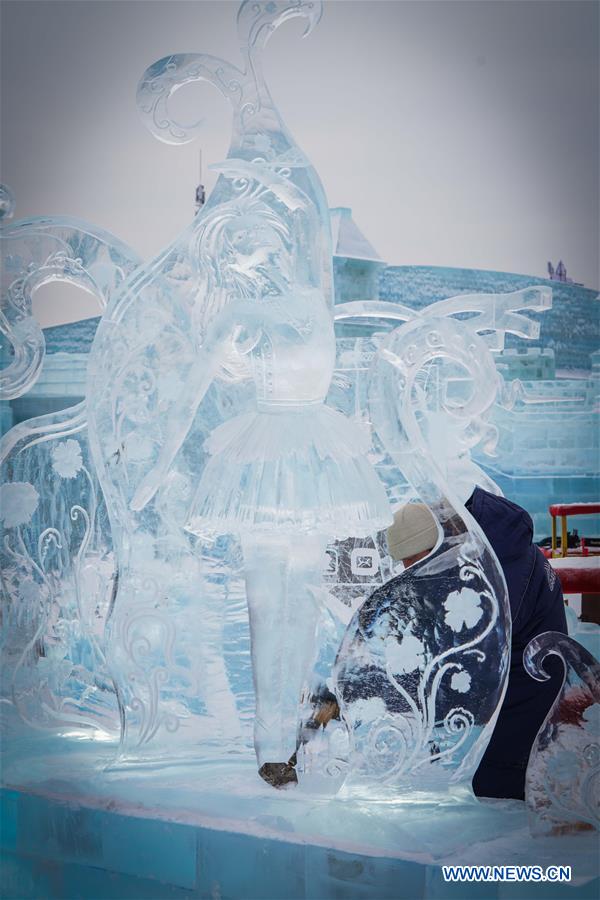
Locate an element on the screen. blue wall is located at coordinates (236, 847).